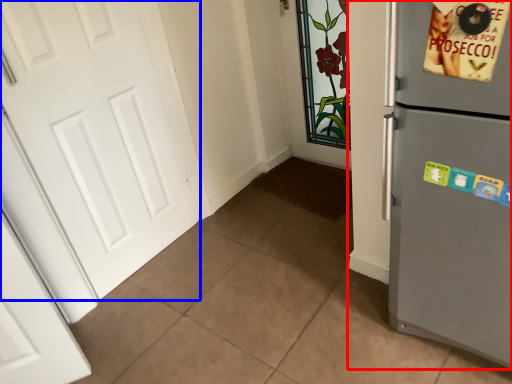
Question: Which point is closer to the camera, refrigerator (highlighted by a red box) or door (highlighted by a blue box)?

Choices:
 (A) refrigerator
 (B) door

Answer: (A)